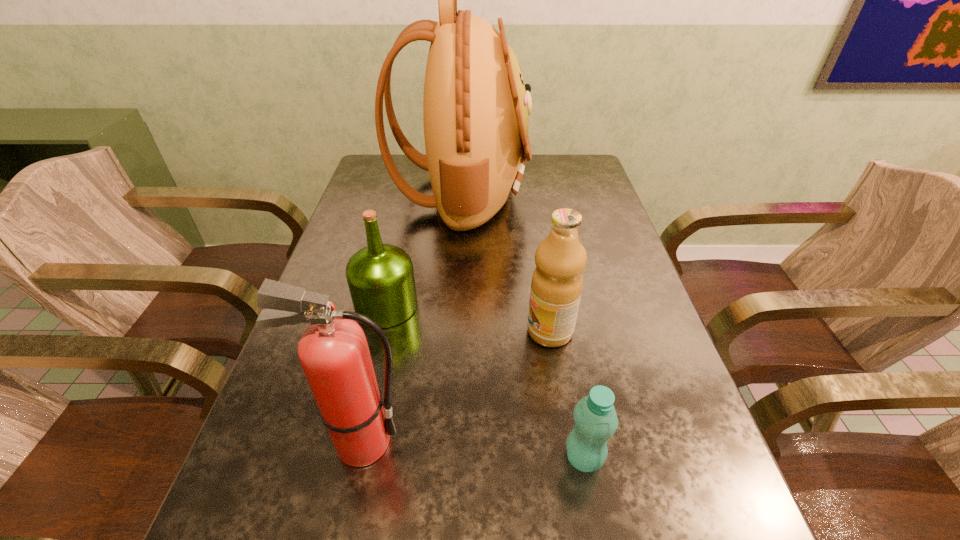
This screenshot has width=960, height=540. Identify the location of blank area in the image that satisfies the following two spatial constraints: 1. on the hose direction of the fourth shortest object; 2. on the back side of the bottle. (358, 458).